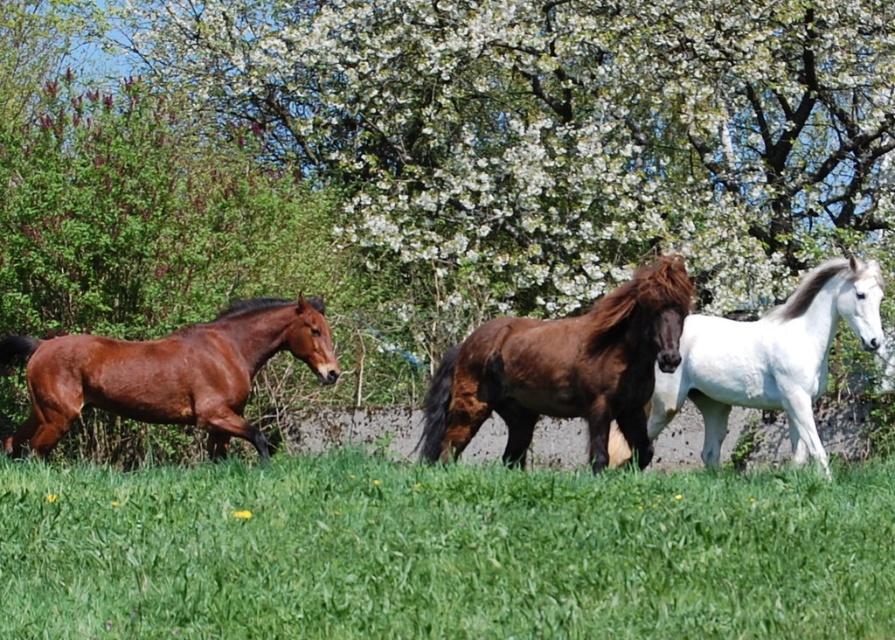
Does green grass at center have a greater height compared to shiny brown horse at left?

No.

Can you confirm if green grass at center is thinner than shiny brown horse at left?

Incorrect, green grass at center's width is not less than shiny brown horse at left's.

In order to click on green grass at center in this screenshot , I will do `click(442, 552)`.

Is point (250, 316) closer to viewer compared to point (798, 339)?

That is True.

Between shiny brown horse at left and white glossy horse at right, which one has less height?

shiny brown horse at left

Is point (305, 346) farther from viewer compared to point (849, 301)?

Yes, point (305, 346) is farther from viewer.

Identify the location of shiny brown horse at left. (168, 372).

Does green grass at center appear under white glossy horse at right?

Correct, green grass at center is located below white glossy horse at right.

Locate an element on the screen. The width and height of the screenshot is (895, 640). green grass at center is located at coordinates (442, 552).

Between point (522, 573) and point (791, 419), which one is positioned in front?

Point (522, 573) is more forward.

Find the location of a particular element. Image resolution: width=895 pixels, height=640 pixels. green grass at center is located at coordinates (442, 552).